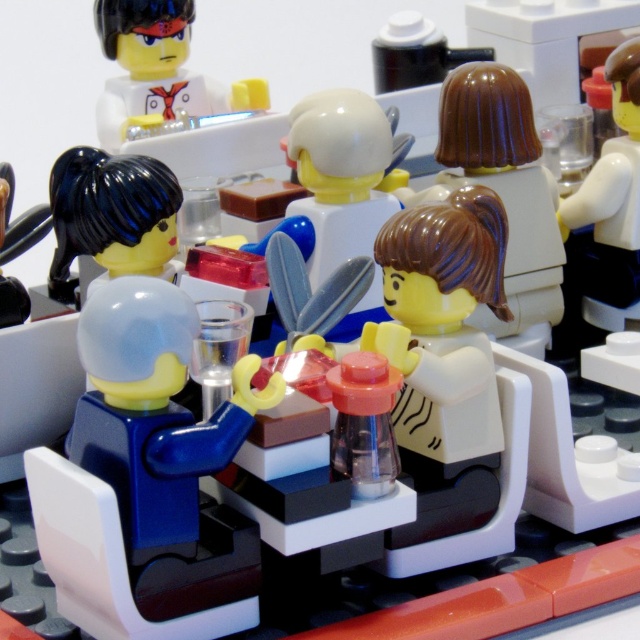
Which is more to the left, matte white minifigure at upper left or white glossy cup at upper right?

From the viewer's perspective, matte white minifigure at upper left appears more on the left side.

Is point (236, 90) less distant than point (632, 253)?

No, it is behind (632, 253).

Locate an element on the screen. This screenshot has width=640, height=640. matte white minifigure at upper left is located at coordinates (157, 68).

Is brown matte hair at upper center positioned before white glossy cup at upper right?

Yes, brown matte hair at upper center is closer to the viewer.

What are the coordinates of `brown matte hair at upper center` in the screenshot? It's located at (504, 193).

The height and width of the screenshot is (640, 640). What are the coordinates of `brown matte hair at upper center` in the screenshot? It's located at (504, 193).

From the picture: Does brown glossy hair at center appear on the right side of brown matte hair at upper center?

No, brown glossy hair at center is not to the right of brown matte hair at upper center.

Looking at this image, which is above, brown glossy hair at center or brown matte hair at upper center?

brown matte hair at upper center is above.

This screenshot has height=640, width=640. Describe the element at coordinates (449, 381) in the screenshot. I see `brown glossy hair at center` at that location.

The height and width of the screenshot is (640, 640). What are the coordinates of `brown glossy hair at center` in the screenshot? It's located at (449, 381).